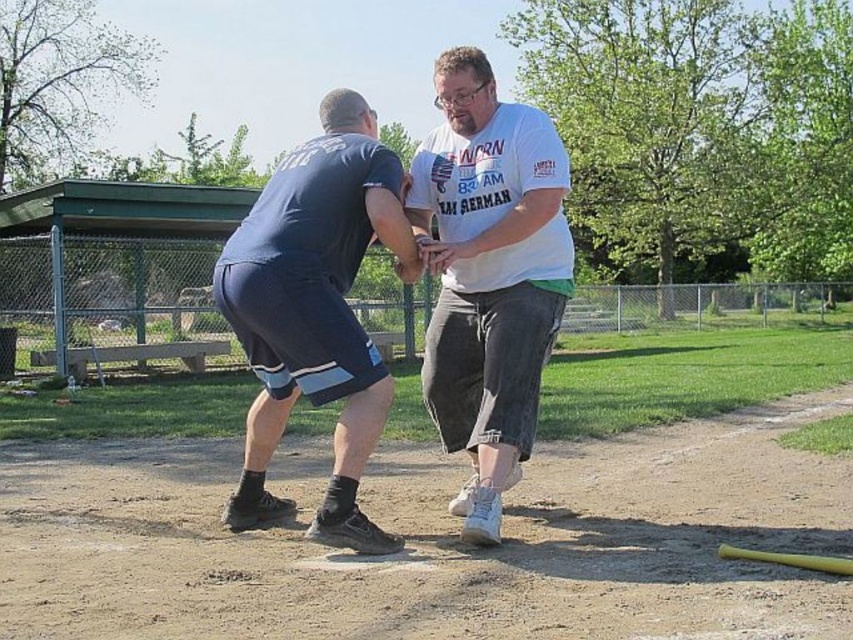
Looking at this image, you are a photographer trying to capture a candid shot of both the white cotton shirt at center and the dark blue shorts at left. Based on their positions, which object should you focus on first to ensure both are in frame?

Since the white cotton shirt at center is to the right of the dark blue shorts at left, you should focus on the dark blue shorts at left first to ensure both are in frame as you pan from left to right.

Based on the scene description, which object is taller between the dark blue shorts at left and the yellow matte baseball bat at lower right?

The dark blue shorts at left is much taller than the yellow matte baseball bat at lower right.

You are a player on the baseball field and need to throw a ball from the point at coordinates point (438, 196) to the point at coordinates point (733, 547). Which point is closer to the home plate?

Point (438, 196) is behind point (733, 547), so the point at coordinates point (733, 547) is closer to the home plate.